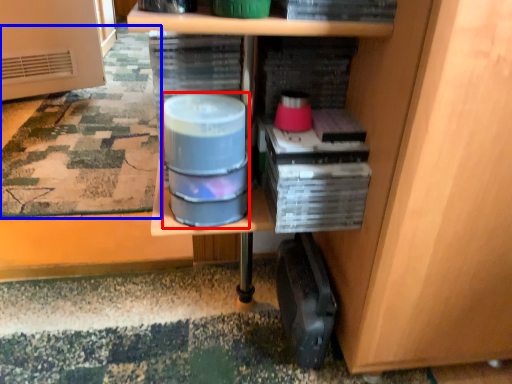
Question: Which of the following is the farthest to the observer, water (highlighted by a red box) or mat (highlighted by a blue box)?

Choices:
 (A) water
 (B) mat

Answer: (B)